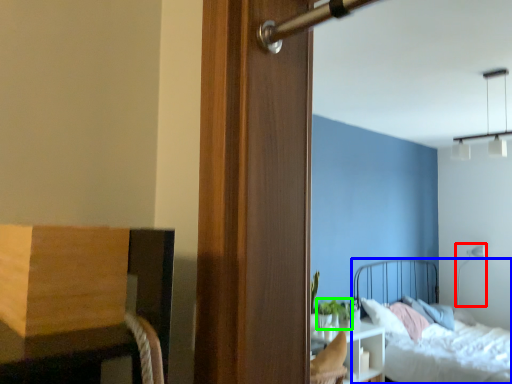
Question: Which object is the closest to the light fixture (highlighted by a red box)? Choose among these: bed (highlighted by a blue box) or plant (highlighted by a green box).

Choices:
 (A) bed
 (B) plant

Answer: (A)